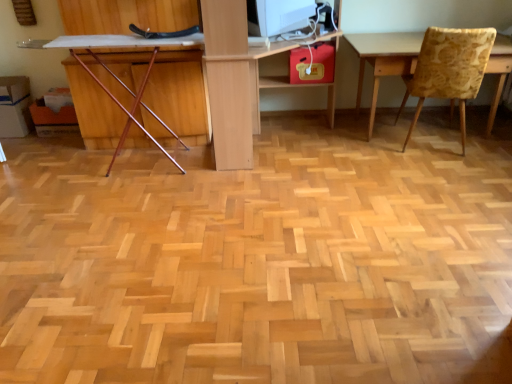
Question: Do you think light wood computer desk at center is within yellow floral fabric chair at right, placed as the second chair when sorted from left to right, or outside of it?

Choices:
 (A) inside
 (B) outside

Answer: (B)

Question: From the image's perspective, relative to yellow floral fabric chair at right, placed as the second chair when sorted from left to right, is light wood computer desk at center above or below?

Choices:
 (A) below
 (B) above

Answer: (B)

Question: Estimate the real-world distances between objects in this image. Which object is closer to the wooden chair at left, placed as the 2th chair when sorted from right to left?

Choices:
 (A) light wood computer desk at center
 (B) white glossy computer monitor at upper center
 (C) yellow floral fabric chair at right, placed as the second chair when sorted from left to right

Answer: (A)

Question: Which object is positioned farthest from the white glossy computer monitor at upper center?

Choices:
 (A) yellow floral fabric chair at right, the 1th chair positioned from the right
 (B) wooden chair at left, placed as the 2th chair when sorted from right to left
 (C) light wood computer desk at center

Answer: (A)